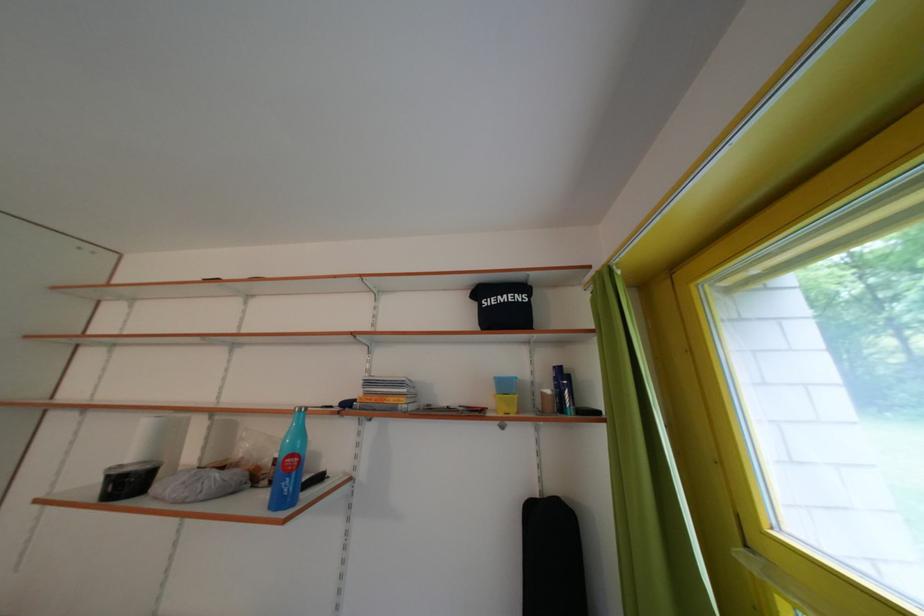
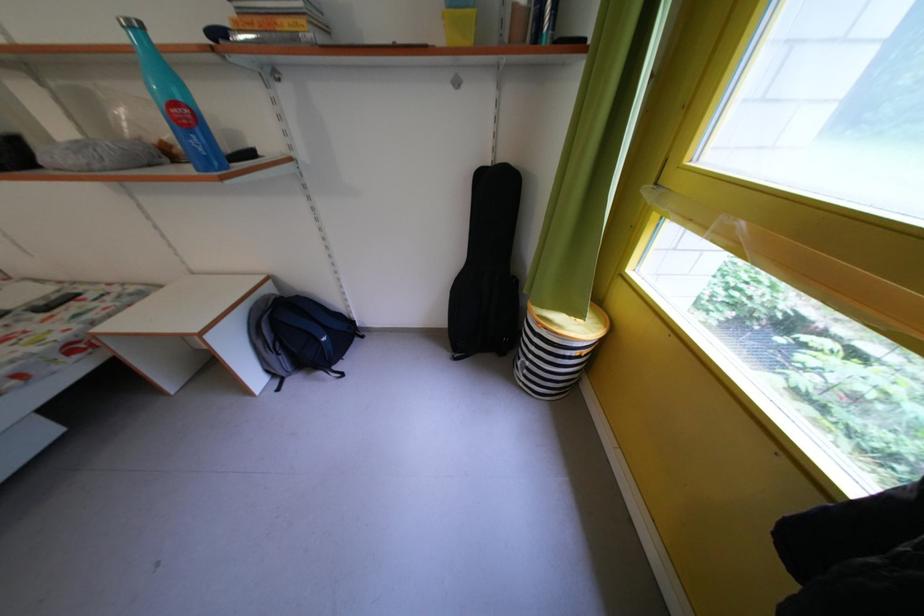
The point at [546,501] is marked in the first image. Where is the corresponding point in the second image?

(499, 171)